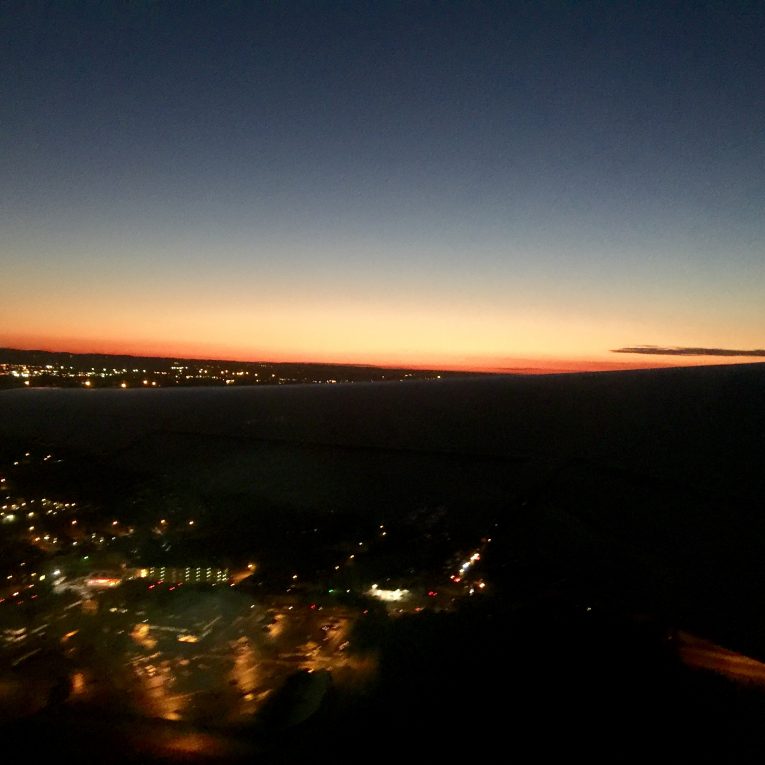
You are a GUI agent. You are given a task and a screenshot of the screen. Output one action in this format:
    pyautogui.click(x=<x>, y=<y>)
    Task: Click on the column of windows
    The height and width of the screenshot is (765, 765).
    Given the screenshot: What is the action you would take?
    pyautogui.click(x=187, y=578), pyautogui.click(x=197, y=578), pyautogui.click(x=207, y=577), pyautogui.click(x=158, y=575)